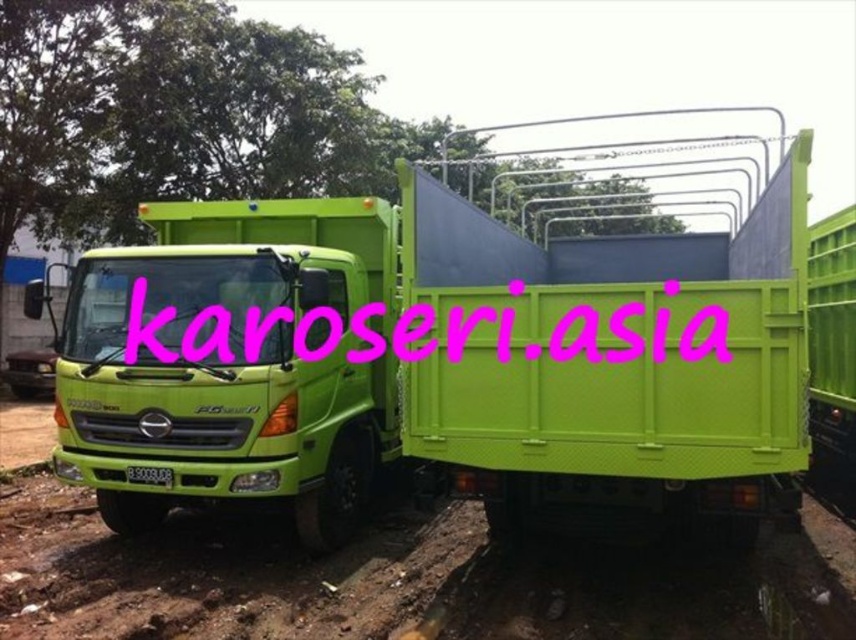
You are a child playing with a toy truck. You have a lime green plastic truck at center and a green matte dirt track at lower left. Which object is closer to you?

The lime green plastic truck at center is closer to you because the green matte dirt track at lower left is behind it.